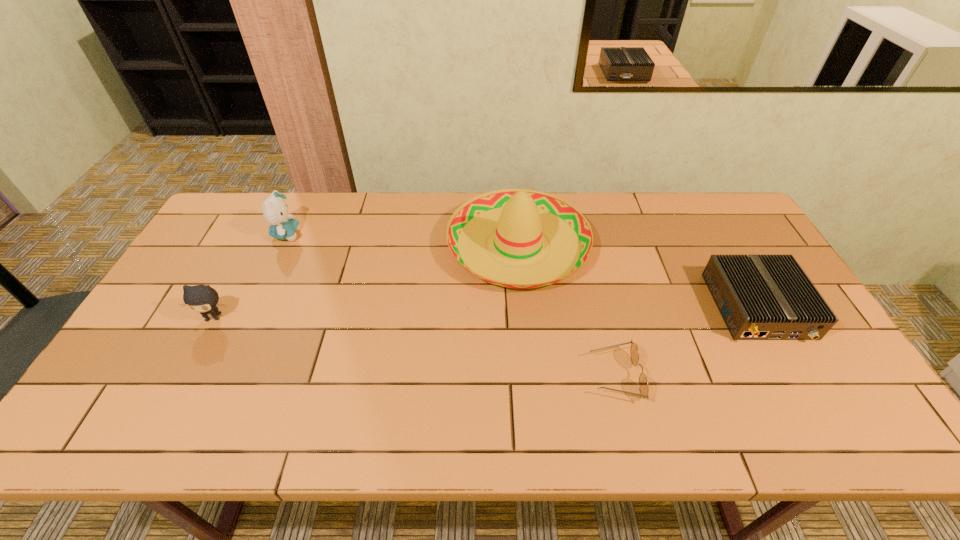
You are a GUI agent. You are given a task and a screenshot of the screen. Output one action in this format:
    pyautogui.click(x=<x>, y=<y>)
    Task: Click on the object located at the right edge
    This screenshot has height=540, width=960.
    Given the screenshot: What is the action you would take?
    pyautogui.click(x=761, y=297)

In the image, there is a desktop. Where is `free space at the far edge`? Image resolution: width=960 pixels, height=540 pixels. free space at the far edge is located at coordinates (444, 218).

Locate an element on the screen. The image size is (960, 540). free location at the near edge is located at coordinates (362, 429).

In order to click on vacant space at the right edge in this screenshot , I will do `click(804, 371)`.

Identify the location of vacant area between the farther kitten and the nearer kitten. (250, 276).

The image size is (960, 540). I want to click on empty space that is in between the second tallest object and the shortest object, so click(x=451, y=305).

Where is `vacant point located between the second shortest object and the spectacles`? The image size is (960, 540). vacant point located between the second shortest object and the spectacles is located at coordinates (686, 341).

Where is `vacant space in between the farther kitten and the nearer kitten`? The height and width of the screenshot is (540, 960). vacant space in between the farther kitten and the nearer kitten is located at coordinates 250,276.

Locate an element on the screen. The width and height of the screenshot is (960, 540). empty location between the sombrero and the rightmost object is located at coordinates (637, 276).

I want to click on vacant point located between the fourth tallest object and the sombrero, so click(637, 276).